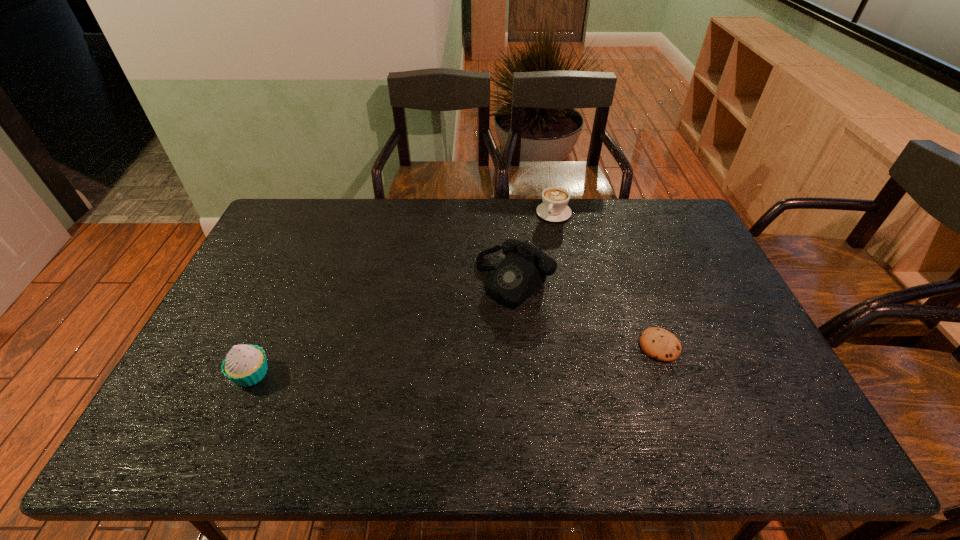
The width and height of the screenshot is (960, 540). Find the location of `vacant space at the left edge`. vacant space at the left edge is located at coordinates (246, 321).

The height and width of the screenshot is (540, 960). I want to click on vacant space at the right edge of the desktop, so click(663, 256).

In the image, there is a desktop. In order to click on free space at the far left corner in this screenshot , I will do `click(312, 211)`.

The height and width of the screenshot is (540, 960). Identify the location of vacant space that is in between the second farthest object and the cupcake. (383, 327).

This screenshot has height=540, width=960. Find the location of `vacant space in between the third tallest object and the leftmost object`. vacant space in between the third tallest object and the leftmost object is located at coordinates (402, 293).

This screenshot has height=540, width=960. I want to click on vacant region between the third nearest object and the leftmost object, so click(383, 327).

The width and height of the screenshot is (960, 540). In order to click on free space between the second farthest object and the leftmost object in this screenshot , I will do `click(383, 327)`.

You are a GUI agent. You are given a task and a screenshot of the screen. Output one action in this format:
    pyautogui.click(x=<x>, y=<y>)
    Task: Click on the free space that is in between the leftmost object and the rightmost object
    
    Given the screenshot: What is the action you would take?
    pyautogui.click(x=455, y=360)

Where is `free space between the telephone and the shortest object`? free space between the telephone and the shortest object is located at coordinates (588, 313).

This screenshot has width=960, height=540. Find the location of `free space that is in between the rightmost object and the second shortest object`. free space that is in between the rightmost object and the second shortest object is located at coordinates (607, 279).